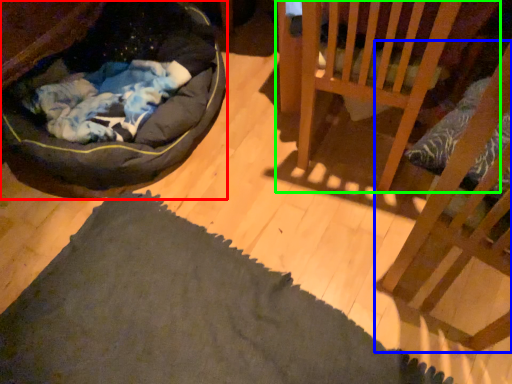
Question: Estimate the real-world distances between objects in this image. Which object is farther from dog bed (highlighted by a red box), furniture (highlighted by a blue box) or furniture (highlighted by a green box)?

Choices:
 (A) furniture
 (B) furniture

Answer: (A)